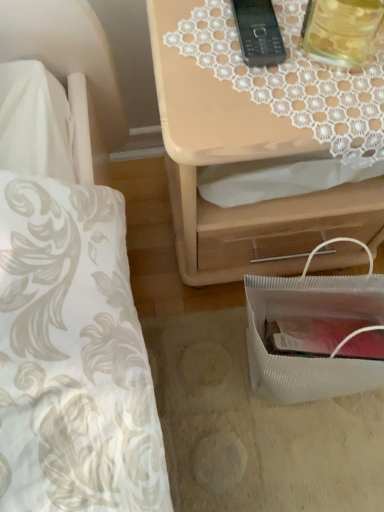
Locate an element on the screen. vacant space situated above light wood/texture nightstand at upper right (from a real-world perspective) is located at coordinates (283, 60).